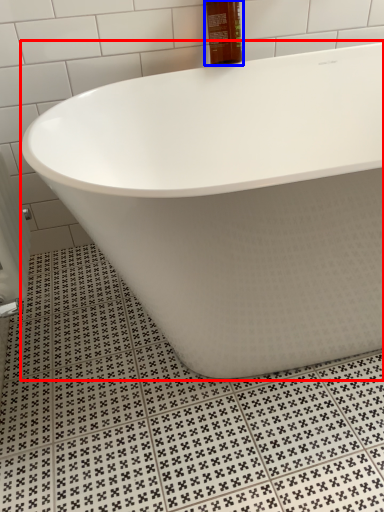
Question: Which object is closer to the camera taking this photo, bathtub (highlighted by a red box) or mouthwash (highlighted by a blue box)?

Choices:
 (A) bathtub
 (B) mouthwash

Answer: (A)